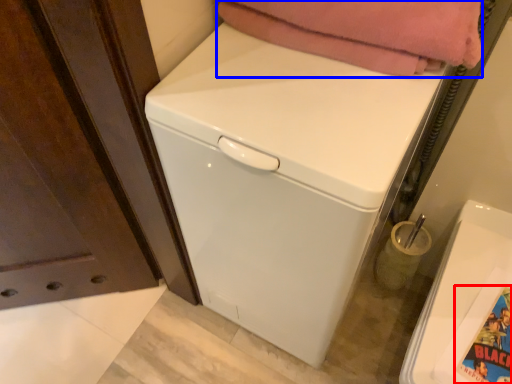
Question: Which point is closer to the camera, comic book character (highlighted by a red box) or blanket (highlighted by a blue box)?

Choices:
 (A) comic book character
 (B) blanket

Answer: (B)